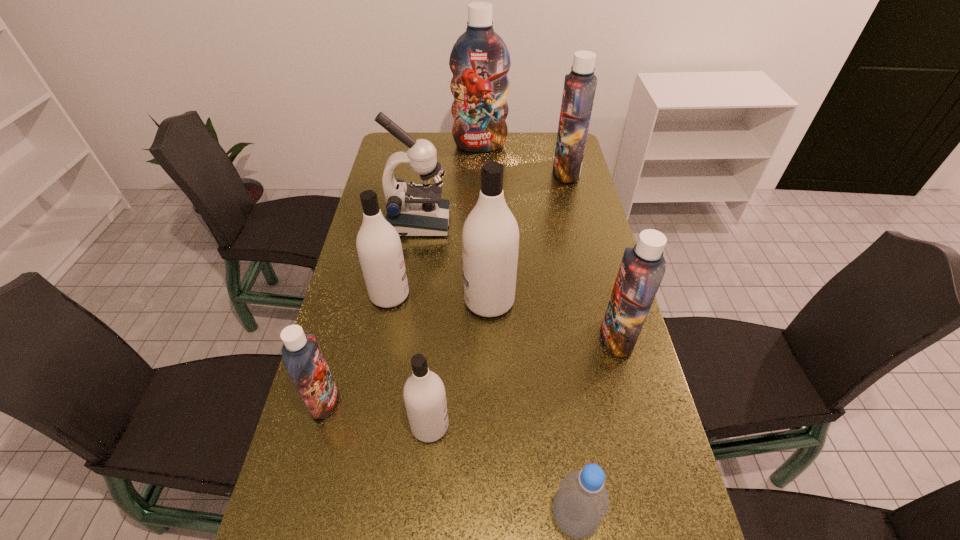
The image size is (960, 540). Find the location of `vacant space at the right edge`. vacant space at the right edge is located at coordinates (582, 383).

You are a GUI agent. You are given a task and a screenshot of the screen. Output one action in this format:
    pyautogui.click(x=<x>, y=<y>)
    Task: Click on the vacant space at the far left corner of the desktop
    
    Given the screenshot: What is the action you would take?
    pyautogui.click(x=391, y=148)

Identify the location of unoccupied area between the microscope and the second white shampoo from right to left. This screenshot has width=960, height=540. (424, 325).

Find the location of a particular element. The height and width of the screenshot is (540, 960). vacant area that lies between the tallest shampoo and the third farthest blue shampoo is located at coordinates (548, 242).

Find the location of a particular element. The height and width of the screenshot is (540, 960). vacant region between the second shampoo from left to right and the nearest white shampoo is located at coordinates [x=410, y=361].

Find the location of a particular element. This screenshot has height=540, width=960. vacant space that is in between the sixth shampoo from right to left and the second nearest blue shampoo is located at coordinates (503, 316).

Identify which object is located as the third nearest to the microscope. Please provide its 2D coordinates. Your answer should be formatted as a tuple, i.e. [(x, y)], where the tuple contains the x and y coordinates of a point satisfying the conditions above.

[(479, 60)]

Choose which object is the second nearest neighbor to the second biggest white shampoo. Please provide its 2D coordinates. Your answer should be formatted as a tuple, i.e. [(x, y)], where the tuple contains the x and y coordinates of a point satisfying the conditions above.

[(416, 210)]

Locate which shampoo ranks in proximity to the second farthest blue shampoo. Please provide its 2D coordinates. Your answer should be formatted as a tuple, i.e. [(x, y)], where the tuple contains the x and y coordinates of a point satisfying the conditions above.

[(479, 60)]

Identify the location of shampoo that can be found as the closest to the third object from right to left. The width and height of the screenshot is (960, 540). (424, 393).